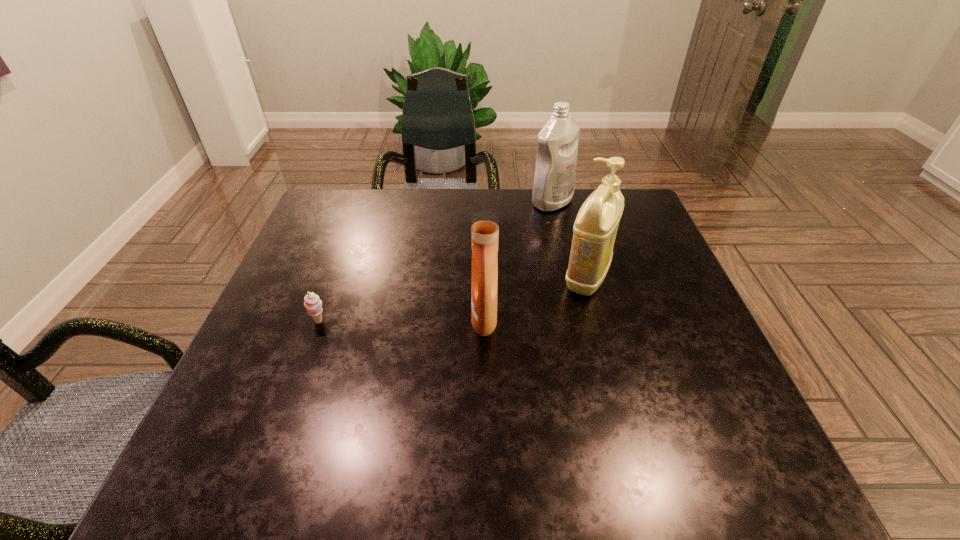
Image resolution: width=960 pixels, height=540 pixels. I want to click on the farthest detergent, so click(x=557, y=145).

Locate an element on the screen. The height and width of the screenshot is (540, 960). the leftmost detergent is located at coordinates (484, 224).

Locate an element on the screen. The height and width of the screenshot is (540, 960). sherbert is located at coordinates (312, 303).

The height and width of the screenshot is (540, 960). What are the coordinates of `the leftmost object` in the screenshot? It's located at (312, 303).

Locate an element on the screen. free location located 0.320m on the front of the farthest detergent is located at coordinates (572, 291).

Find the location of a particular element. The height and width of the screenshot is (540, 960). vacant space located on the front-facing side of the leftmost detergent is located at coordinates (325, 319).

Identify the location of free region located 0.120m on the front-facing side of the leftmost detergent. The image size is (960, 540). (417, 319).

Where is `blank area located on the front-facing side of the leftmost detergent`? This screenshot has width=960, height=540. blank area located on the front-facing side of the leftmost detergent is located at coordinates (303, 319).

Where is `free spot located 0.070m on the front of the shortest object`? Image resolution: width=960 pixels, height=540 pixels. free spot located 0.070m on the front of the shortest object is located at coordinates (307, 354).

At what (x,y) coordinates should I click in order to perform the action: click on object located at the far edge. Please return your answer as a coordinate pair (x, y). The width and height of the screenshot is (960, 540). Looking at the image, I should click on (557, 145).